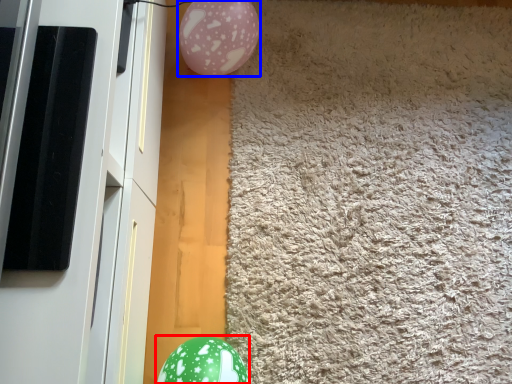
Question: Among these objects, which one is farthest to the camera, egg (highlighted by a red box) or balloon (highlighted by a blue box)?

Choices:
 (A) egg
 (B) balloon

Answer: (B)